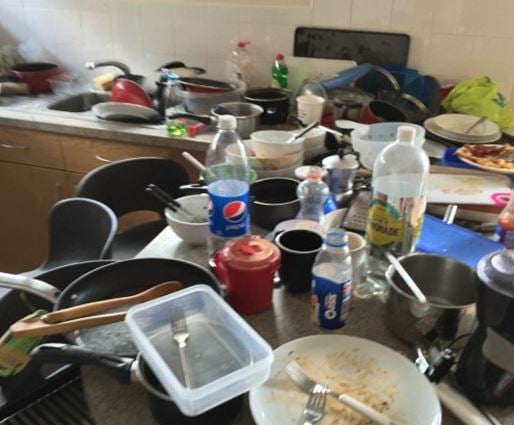
At what (x,y) coordinates should I click in order to perform the action: click on faucet. Please return your answer as a coordinate pair (x, y). Looking at the image, I should click on (96, 62).